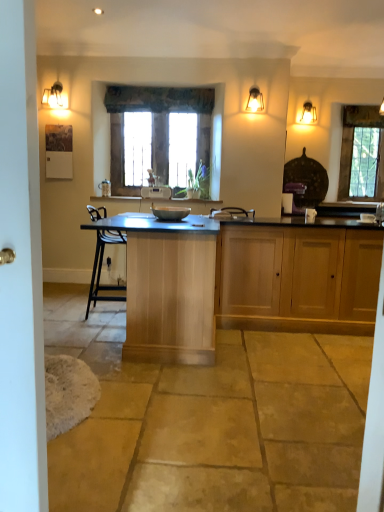
Question: Is matte brass light fixture at upper right, arranged as the third light fixture when viewed from the back, to the right of satin nickel faucet at right from the viewer's perspective?

Choices:
 (A) yes
 (B) no

Answer: (B)

Question: Is matte brass light fixture at upper right, arranged as the third light fixture when viewed from the back, beside satin nickel faucet at right?

Choices:
 (A) yes
 (B) no

Answer: (B)

Question: Does matte brass light fixture at upper right, marked as the 1th light fixture in a front-to-back arrangement, come in front of satin nickel faucet at right?

Choices:
 (A) no
 (B) yes

Answer: (A)

Question: Is matte brass light fixture at upper right, the 2th light fixture viewed from the left, wider than satin nickel faucet at right?

Choices:
 (A) yes
 (B) no

Answer: (A)

Question: Considering the relative positions of matte brass light fixture at upper right, the 2th light fixture viewed from the left, and satin nickel faucet at right in the image provided, is matte brass light fixture at upper right, the 2th light fixture viewed from the left, to the left of satin nickel faucet at right from the viewer's perspective?

Choices:
 (A) yes
 (B) no

Answer: (A)

Question: Does matte brass light fixture at upper right, the 2th light fixture viewed from the left, have a lesser height compared to satin nickel faucet at right?

Choices:
 (A) no
 (B) yes

Answer: (A)

Question: Does satin nickel faucet at right come behind matte glass sconce at upper right, which appears as the first light fixture when viewed from the right?

Choices:
 (A) yes
 (B) no

Answer: (B)

Question: From a real-world perspective, is satin nickel faucet at right positioned under matte glass sconce at upper right, the 3th light fixture from the left, based on gravity?

Choices:
 (A) no
 (B) yes

Answer: (B)

Question: Is satin nickel faucet at right smaller than matte glass sconce at upper right, the 3th light fixture from the left?

Choices:
 (A) yes
 (B) no

Answer: (A)

Question: Does satin nickel faucet at right turn towards matte glass sconce at upper right, which appears as the first light fixture when viewed from the right?

Choices:
 (A) no
 (B) yes

Answer: (A)

Question: Is the position of satin nickel faucet at right less distant than that of matte glass sconce at upper right, which appears as the first light fixture when viewed from the right?

Choices:
 (A) no
 (B) yes

Answer: (B)

Question: Considering the relative positions of satin nickel faucet at right and matte glass sconce at upper right, positioned as the 1th light fixture in back-to-front order, in the image provided, is satin nickel faucet at right to the right of matte glass sconce at upper right, positioned as the 1th light fixture in back-to-front order, from the viewer's perspective?

Choices:
 (A) yes
 (B) no

Answer: (A)

Question: From a real-world perspective, is light wood cabinet at center, the 1th cabinetry when ordered from left to right, located beneath wooden frame at center, marked as the 2th window in a back-to-front arrangement?

Choices:
 (A) no
 (B) yes

Answer: (B)